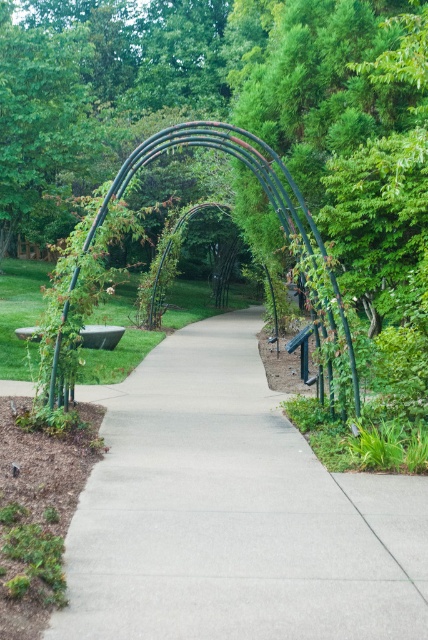
Question: From the image, what is the correct spatial relationship of green metal archway at center in relation to black metal archway at center?

Choices:
 (A) left
 (B) right

Answer: (B)

Question: Does concrete at center appear under green metal archway at center?

Choices:
 (A) no
 (B) yes

Answer: (B)

Question: Among these objects, which one is nearest to the camera?

Choices:
 (A) green metal archway at center
 (B) concrete at center

Answer: (B)

Question: Estimate the real-world distances between objects in this image. Which object is farther from the black metal archway at center?

Choices:
 (A) green metal archway at center
 (B) concrete at center

Answer: (B)

Question: Which point is farther from the camera taking this photo?

Choices:
 (A) (166, 134)
 (B) (106, 625)
 (C) (171, 266)

Answer: (C)

Question: Is concrete at center to the left of green metal archway at center from the viewer's perspective?

Choices:
 (A) no
 (B) yes

Answer: (B)